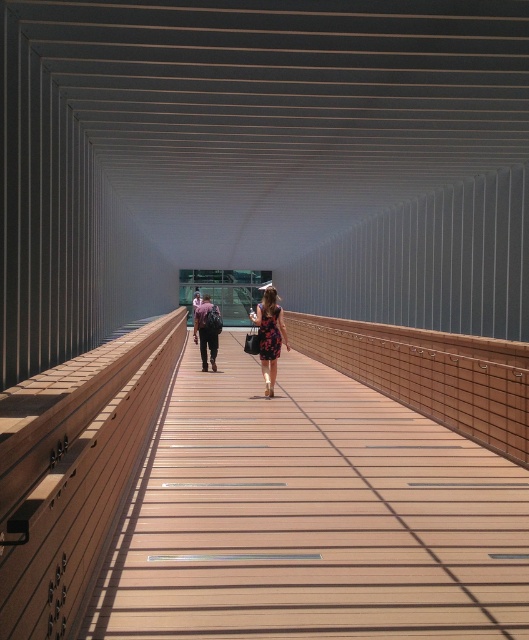
Question: Observing the image, what is the correct spatial positioning of floral dress at center in reference to matte black backpack at center?

Choices:
 (A) above
 (B) below

Answer: (A)

Question: Can you confirm if matte black backpack at center is smaller than floral-patterned fabric dress at center?

Choices:
 (A) no
 (B) yes

Answer: (A)

Question: Which object is positioned farthest from the floral-patterned fabric dress at center?

Choices:
 (A) floral dress at center
 (B) brown wooden bridge at center
 (C) matte black backpack at center

Answer: (C)

Question: Which point appears farthest from the camera in this image?

Choices:
 (A) (124, 593)
 (B) (276, 330)
 (C) (275, 360)

Answer: (C)

Question: Which is nearer to the matte black backpack at center?

Choices:
 (A) floral-patterned fabric dress at center
 (B) brown wooden bridge at center
 (C) floral dress at center

Answer: (C)

Question: Can you confirm if brown wooden bridge at center is positioned above matte black backpack at center?

Choices:
 (A) no
 (B) yes

Answer: (A)